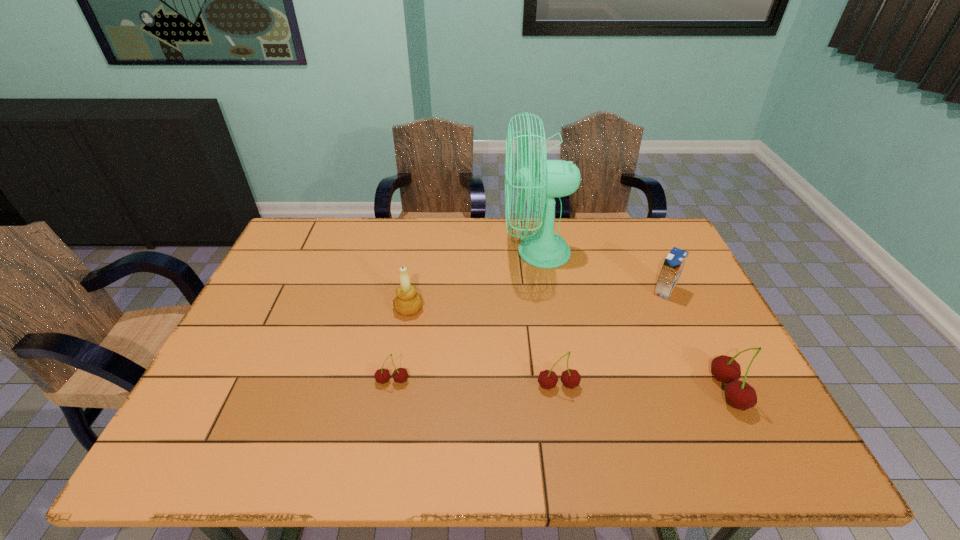
The cherrys are evenly distributed in the image. To maintain this, where would you place another cherry on the left? Please point to a free space. Please provide its 2D coordinates. Your answer should be formatted as a tuple, i.e. [(x, y)], where the tuple contains the x and y coordinates of a point satisfying the conditions above.

[(230, 376)]